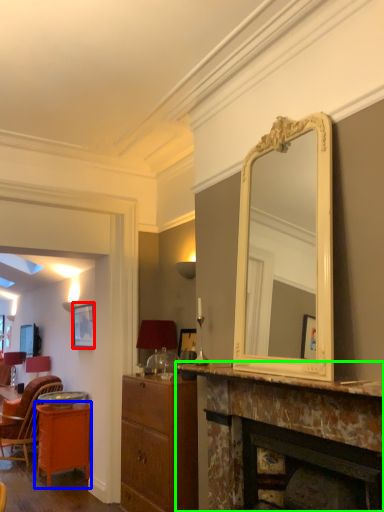
Question: Based on their relative distances, which object is farther from picture frame (highlighted by a red box)? Choose from table (highlighted by a blue box) and fireplace (highlighted by a green box).

Choices:
 (A) table
 (B) fireplace

Answer: (B)